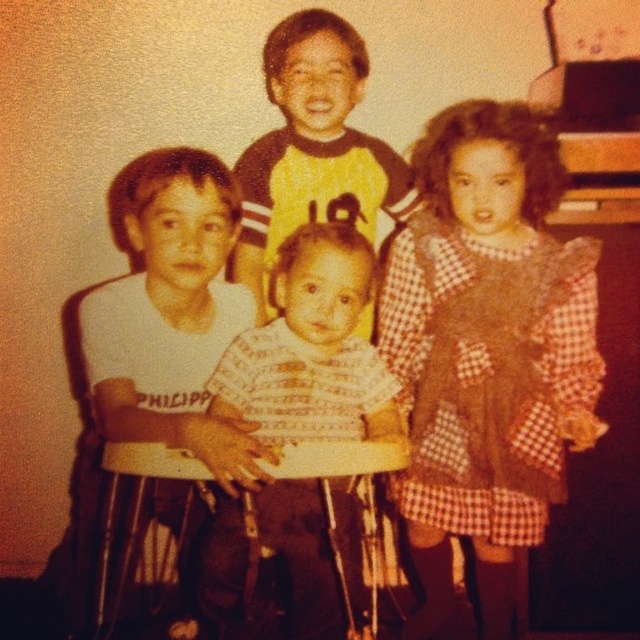
Where is `brown checkered dress at center`? Image resolution: width=640 pixels, height=640 pixels. brown checkered dress at center is located at coordinates (486, 349).

Looking at this image, can you confirm if brown checkered dress at center is shorter than yellow jersey at center?

No.

Does point (524, 237) come in front of point (272, 93)?

Yes, it is.

The image size is (640, 640). I want to click on brown checkered dress at center, so click(486, 349).

Can you confirm if white cotton shirt at left is taller than yellow jersey at center?

In fact, white cotton shirt at left may be shorter than yellow jersey at center.

Does white cotton shirt at left have a smaller size compared to yellow jersey at center?

Yes, white cotton shirt at left is smaller than yellow jersey at center.

Does point (86, 349) lie in front of point (396, 154)?

Yes, it is.

The width and height of the screenshot is (640, 640). Identify the location of white cotton shirt at left. (170, 314).

Does white cotton shirt at left come behind white striped shirt at center?

No, white cotton shirt at left is in front of white striped shirt at center.

Who is positioned more to the left, white cotton shirt at left or white striped shirt at center?

white cotton shirt at left is more to the left.

Where is `white cotton shirt at left`? This screenshot has height=640, width=640. white cotton shirt at left is located at coordinates pyautogui.click(x=170, y=314).